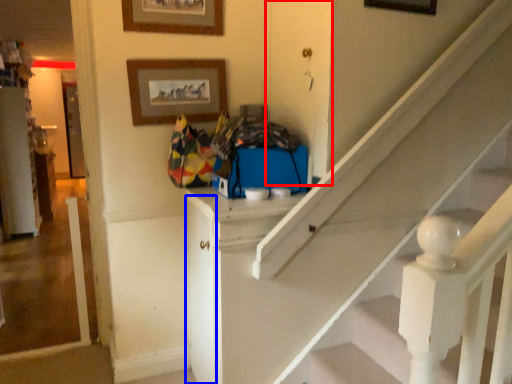
Question: Which object appears closest to the camera in this image, door (highlighted by a red box) or door (highlighted by a blue box)?

Choices:
 (A) door
 (B) door

Answer: (A)